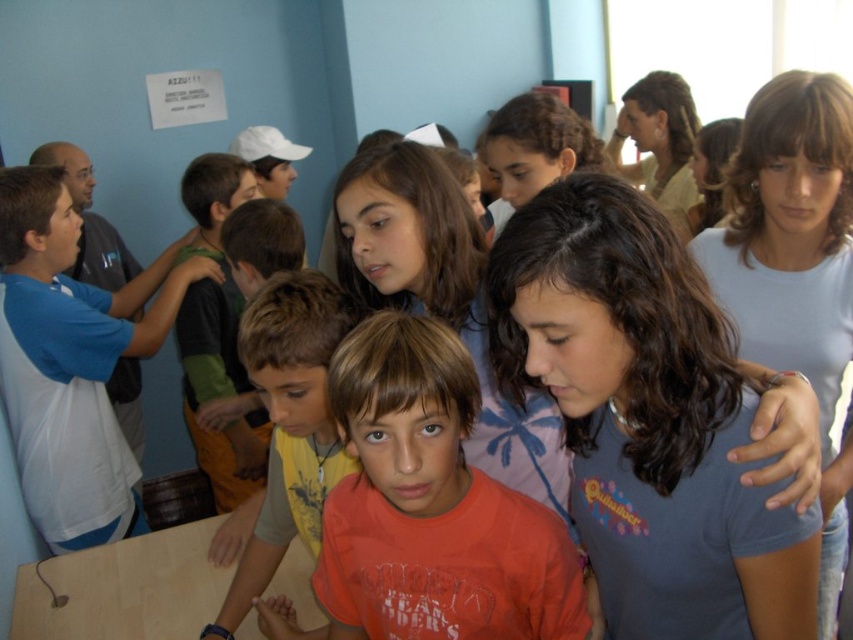
You are a photographer trying to capture a group photo of the children in the classroom. You notice the orange cotton shirt at center and the light blue cotton shirt at center. Which child should you adjust to ensure both shirts are visible in the photo?

The orange cotton shirt at center is positioned under light blue cotton shirt at center, so you should adjust the child in the orange cotton shirt at center to move upwards to avoid being blocked by the light blue one.

You are a teacher in the classroom and want to hand out a worksheet to the student in the orange cotton shirt at center and the student in the light blue cotton shirt at center. Which student should you approach first to ensure you reach them without needing to move around others?

You should approach the orange cotton shirt at center first because they are in front of the light blue cotton shirt at center, making them more accessible.

You are a teacher in the classroom and want to call on a student wearing a white cotton shirt at left. Based on their position in the image, can you estimate where they are located relative to the other children?

The white cotton shirt at left is located at point (73, 362), which places them near the lower left corner of the image, likely at the edge of the group of children.